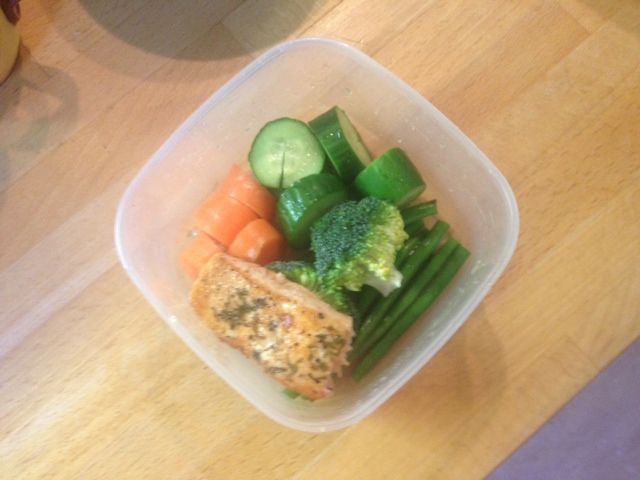
You are a GUI agent. You are given a task and a screenshot of the screen. Output one action in this format:
    pyautogui.click(x=<x>, y=<y>)
    Task: Click on the wooden table
    The width and height of the screenshot is (640, 480).
    Given the screenshot: What is the action you would take?
    pyautogui.click(x=99, y=397)